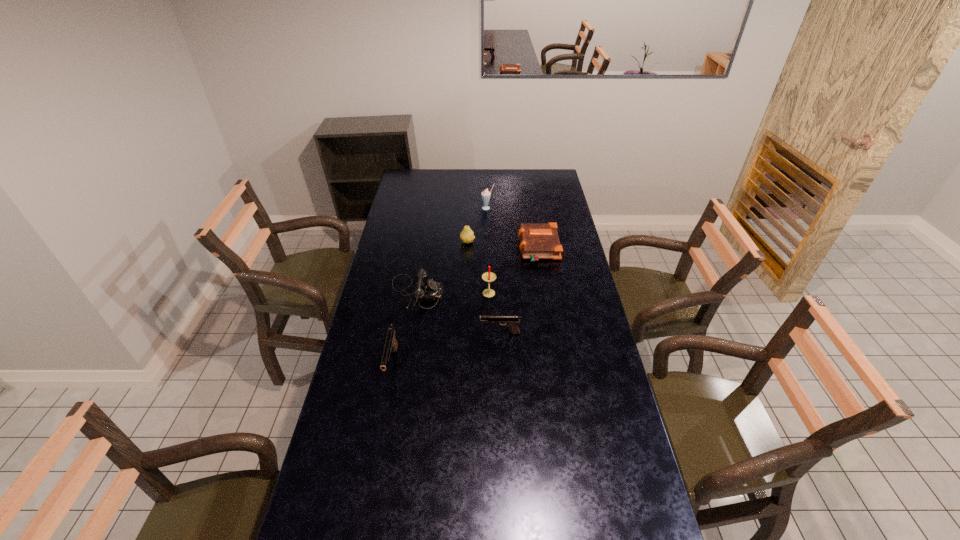
The height and width of the screenshot is (540, 960). Identify the location of the nearest object. (391, 344).

Where is `the left pistol`? This screenshot has height=540, width=960. the left pistol is located at coordinates point(391,344).

Find the location of `the sixth farthest object`. the sixth farthest object is located at coordinates (512, 322).

Locate an element on the screen. The image size is (960, 540). the right pistol is located at coordinates (512, 322).

Find the location of a particular element. The height and width of the screenshot is (540, 960). the farthest object is located at coordinates coord(486,195).

This screenshot has height=540, width=960. I want to click on the rightmost object, so click(x=538, y=241).

Image resolution: width=960 pixels, height=540 pixels. In order to click on the shortest object in this screenshot , I will do `click(538, 241)`.

The width and height of the screenshot is (960, 540). Identify the location of telephone. (429, 290).

Where is `candle`? candle is located at coordinates (488, 276).

Where is `the third object from left to right`? The height and width of the screenshot is (540, 960). the third object from left to right is located at coordinates 467,236.